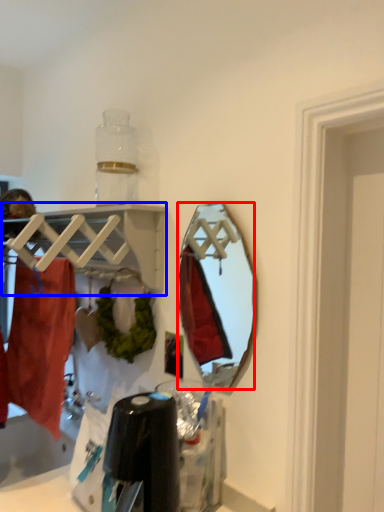
Question: Which object is closer to the camera taking this photo, mirror (highlighted by a red box) or shelf (highlighted by a blue box)?

Choices:
 (A) mirror
 (B) shelf

Answer: (B)